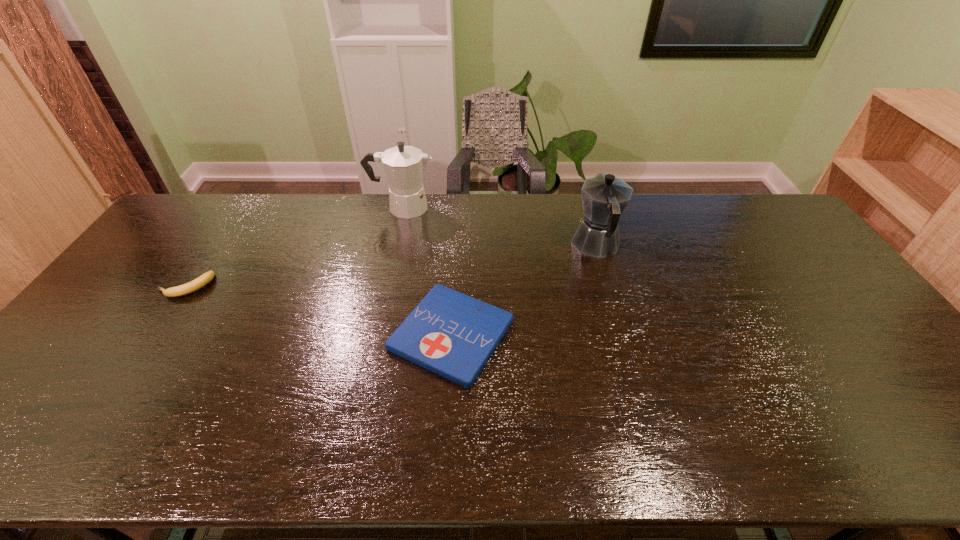
The height and width of the screenshot is (540, 960). In order to click on free space located 0.050m on the back of the leftmost object in this screenshot , I will do pos(202,262).

Where is `free location located on the back of the shortest object`? This screenshot has width=960, height=540. free location located on the back of the shortest object is located at coordinates (458, 224).

I want to click on object located in the left edge section of the desktop, so click(206, 278).

Locate an element on the screen. This screenshot has width=960, height=540. vacant space at the far edge of the desktop is located at coordinates (233, 223).

I want to click on vacant space at the near edge, so click(377, 464).

At what (x,y) coordinates should I click in order to perform the action: click on vacant space at the left edge of the desktop. Please return your answer as a coordinate pair (x, y). Looking at the image, I should click on (182, 245).

Locate an element on the screen. The height and width of the screenshot is (540, 960). free space between the leftmost object and the left coffeepot is located at coordinates (295, 247).

Where is `vacant space that is in between the shortest object and the banana`? The width and height of the screenshot is (960, 540). vacant space that is in between the shortest object and the banana is located at coordinates (319, 310).

Identify the location of free spot between the banana and the shortest object. (319, 310).

Locate an element on the screen. The height and width of the screenshot is (540, 960). vacant area between the banana and the nearer coffeepot is located at coordinates (391, 266).